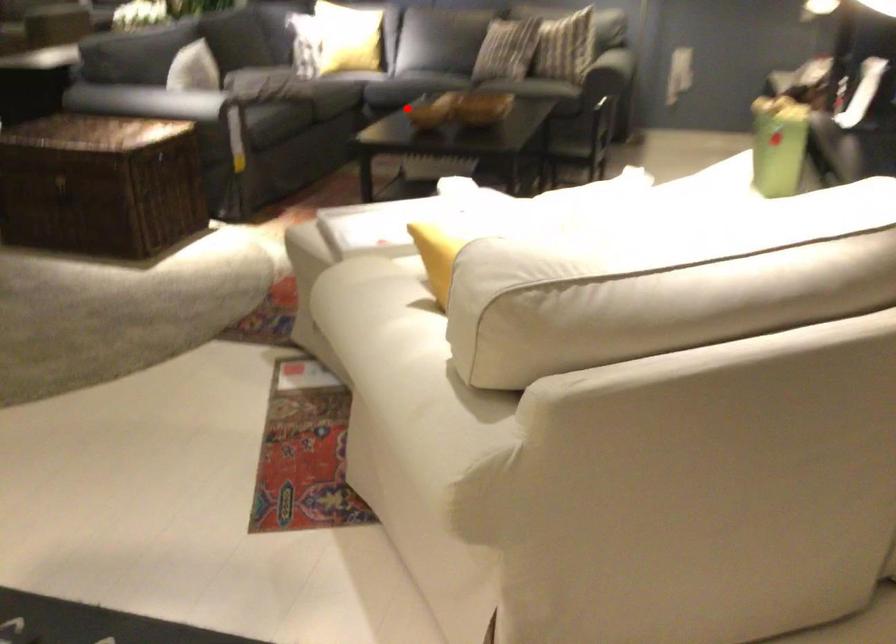
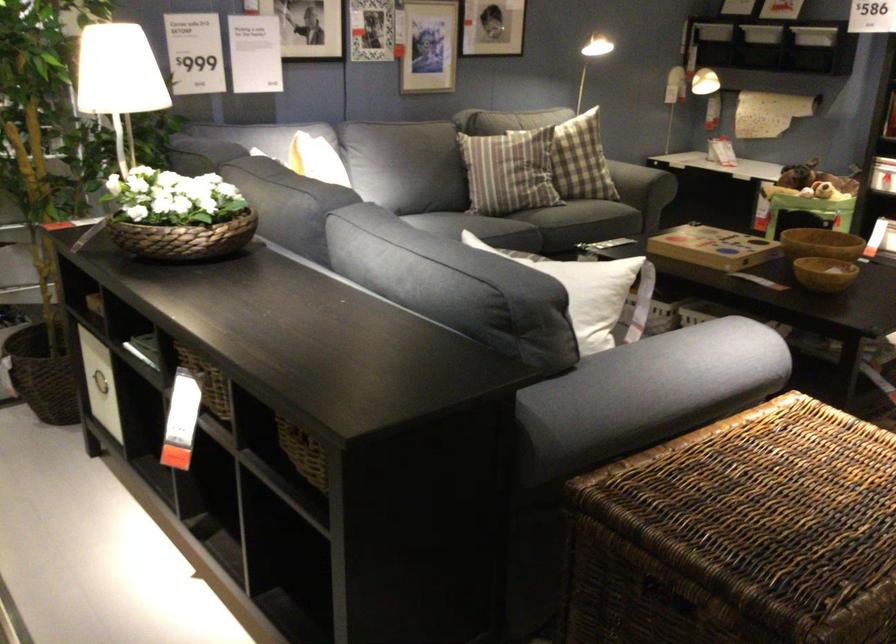
Question: I am providing you with two images of the same scene from different viewpoints. Image1 has a red point marked. In image2, the corresponding 3D location appears at what relative position? Reply with the corresponding letter.

Choices:
 (A) Closer
 (B) Farther

Answer: (A)